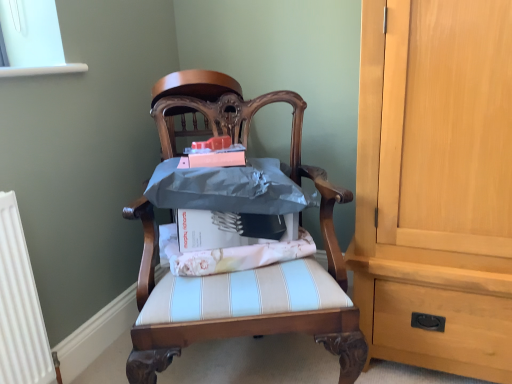
Question: From a real-world perspective, is wooden chair at center, which is the second chair in top-to-bottom order, above or below white striped fabric at center?

Choices:
 (A) above
 (B) below

Answer: (B)

Question: Considering the positions of wooden chair at center, which appears as the first chair when ordered from the bottom, and white striped fabric at center in the image, is wooden chair at center, which appears as the first chair when ordered from the bottom, taller or shorter than white striped fabric at center?

Choices:
 (A) tall
 (B) short

Answer: (A)

Question: Which object is positioned closest to the metallic blue cushion at center, which is the second chair from bottom to top?

Choices:
 (A) white striped fabric at center
 (B) wooden chair at center, which is the second chair in top-to-bottom order

Answer: (B)

Question: Considering the real-world distances, which object is farthest from the white striped fabric at center?

Choices:
 (A) wooden chair at center, which is the second chair in top-to-bottom order
 (B) metallic blue cushion at center, which is the second chair from bottom to top

Answer: (B)